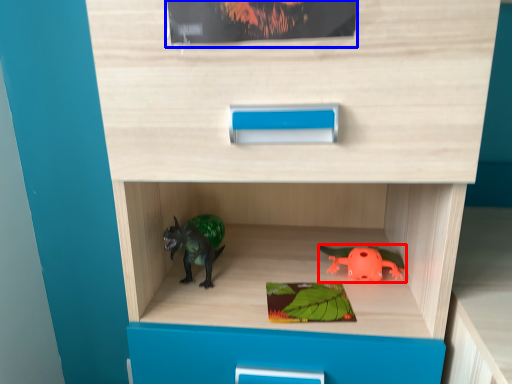
Question: Which object appears farthest to the camera in this image, toy (highlighted by a red box) or paperback book (highlighted by a blue box)?

Choices:
 (A) toy
 (B) paperback book

Answer: (A)